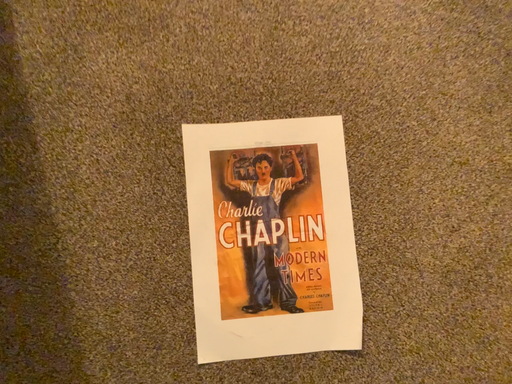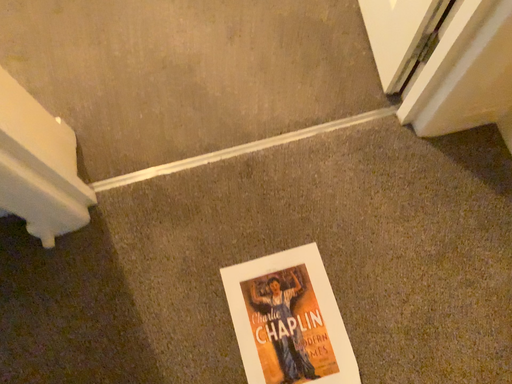
Question: Which way did the camera rotate in the video?

Choices:
 (A) rotated upward
 (B) rotated downward

Answer: (A)